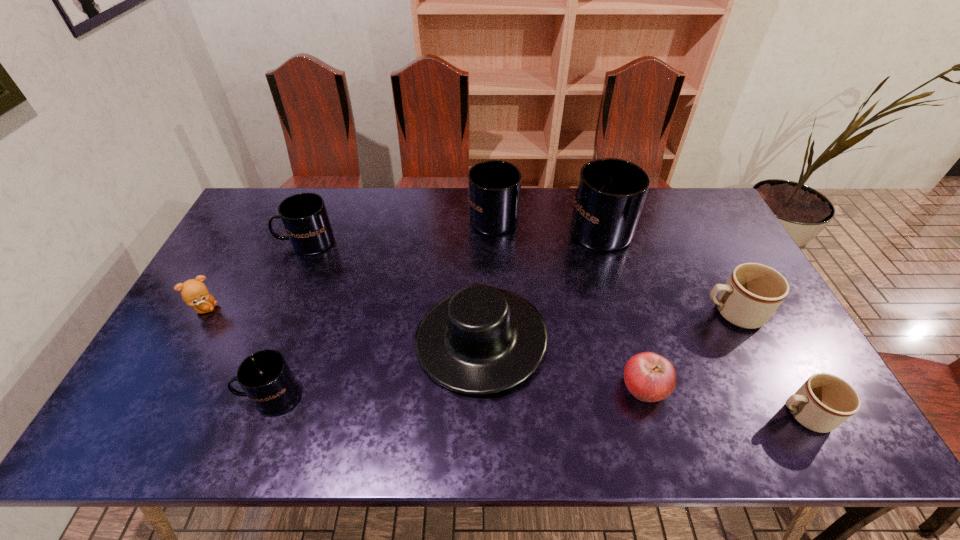
In the image, there is a desktop. Where is `vacant space at the right edge`? The width and height of the screenshot is (960, 540). vacant space at the right edge is located at coordinates (789, 367).

Image resolution: width=960 pixels, height=540 pixels. What are the coordinates of `free space at the far left corner of the desktop` in the screenshot? It's located at (256, 197).

Locate an element on the screen. free space at the near right corner of the desktop is located at coordinates (803, 439).

Where is `vacant area between the black dress hat and the third biggest black mug`? This screenshot has height=540, width=960. vacant area between the black dress hat and the third biggest black mug is located at coordinates (394, 291).

The image size is (960, 540). I want to click on free space between the third black mug from left to right and the apple, so click(569, 301).

What are the coordinates of `vacant area between the second smallest black mug and the tallest mug` in the screenshot? It's located at (453, 234).

This screenshot has width=960, height=540. In order to click on vacant area that lies between the teddy bear and the nearest black mug in this screenshot , I will do `click(237, 352)`.

At what (x,y) coordinates should I click in order to perform the action: click on unoccupied position between the nearer brown mug and the apple. Please return your answer as a coordinate pair (x, y). Looking at the image, I should click on (724, 401).

The width and height of the screenshot is (960, 540). What are the coordinates of `free space between the eighth shortest object and the smallest black mug` in the screenshot? It's located at (381, 305).

In order to click on vacant area that lies between the dress hat and the tallest object in this screenshot , I will do `click(540, 282)`.